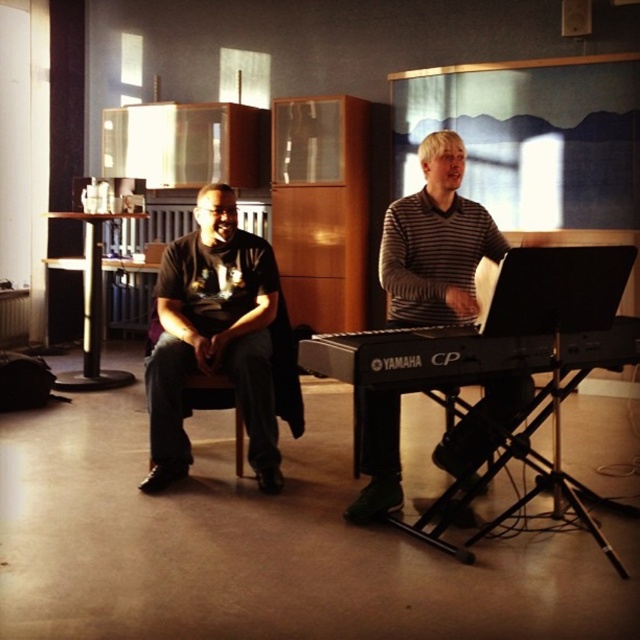
You are a photographer setting up for a photoshoot in the room. You need to position a spotlight so that it illuminates both the matte black shirt at left and the striped sweater at center without casting shadows on the walls. Given their heights, which object should the spotlight be aimed at first to ensure proper lighting?

The spotlight should first be aimed at the matte black shirt at left because it is taller than the striped sweater at center. By focusing on the taller object first, you can adjust the light to cover both effectively without casting shadows on the walls.

You are a photographer positioned at the entrance of the room. You want to take a photo that includes both the striped sweater at center and the black matte keyboard at center. Which object should you focus on first to ensure both are in focus?

You should focus on the striped sweater at center first because it is closer to you than the black matte keyboard at center, so focusing on it will ensure the keyboard in the background is also in focus.